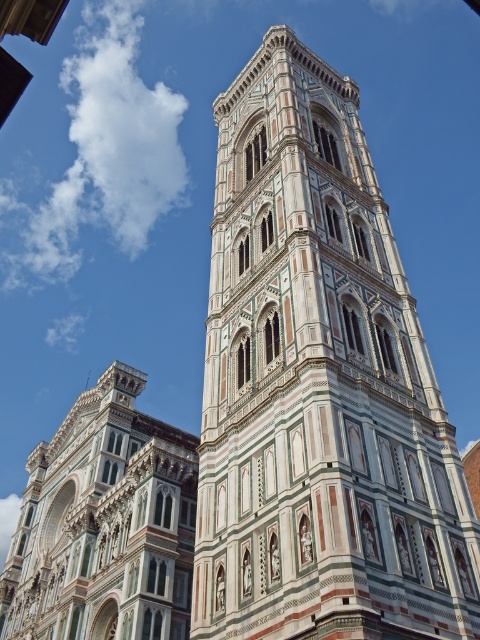
The image size is (480, 640). Describe the element at coordinates (319, 387) in the screenshot. I see `multicolored stone tower at center` at that location.

Is multicolored stone tower at center taller than multicolored mosaic tower at center?

Correct, multicolored stone tower at center is much taller as multicolored mosaic tower at center.

Describe the element at coordinates (319, 387) in the screenshot. This screenshot has width=480, height=640. I see `multicolored stone tower at center` at that location.

What are the coordinates of `multicolored stone tower at center` in the screenshot? It's located at (319, 387).